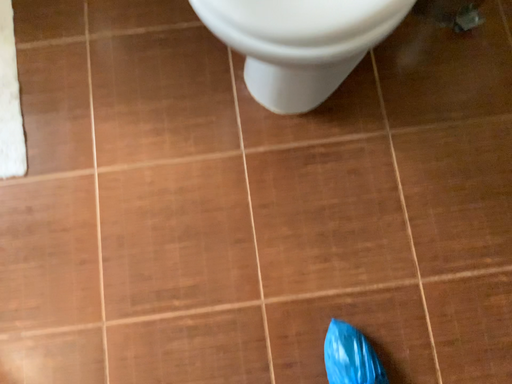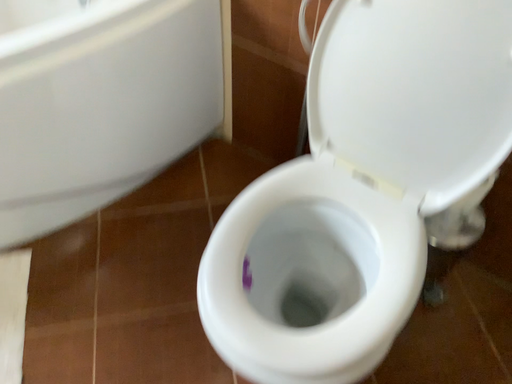
Question: Which way did the camera rotate in the video?

Choices:
 (A) rotated downward
 (B) rotated upward

Answer: (B)